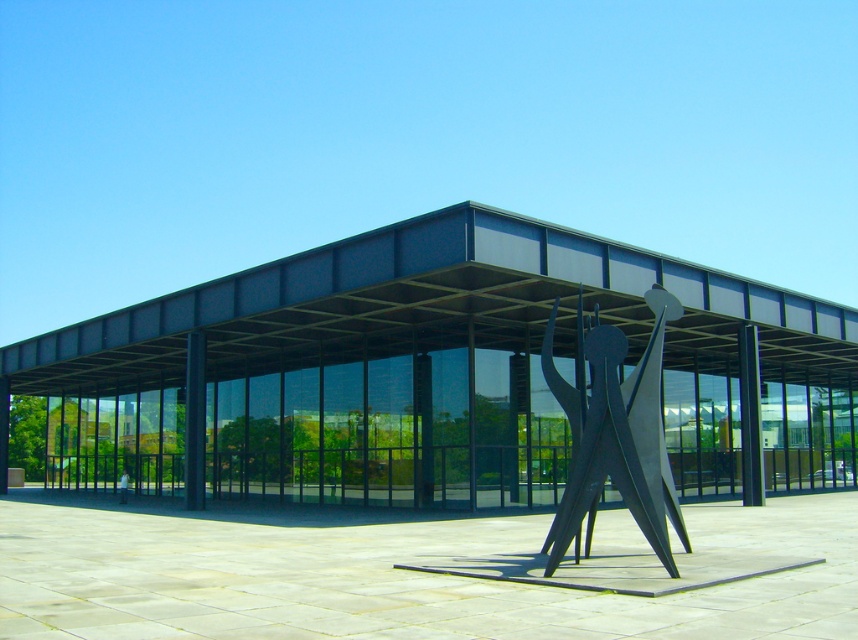
Question: Can you confirm if black metal canopy at center is positioned to the right of polished steel sculpture at center?

Choices:
 (A) yes
 (B) no

Answer: (B)

Question: Does smooth concrete plaza at center appear on the left side of black metal canopy at center?

Choices:
 (A) yes
 (B) no

Answer: (B)

Question: Which of the following is the farthest from the observer?

Choices:
 (A) (521, 612)
 (B) (641, 337)

Answer: (B)

Question: Which of the following is the farthest from the observer?

Choices:
 (A) click(101, 364)
 (B) click(601, 412)
 (C) click(112, 326)

Answer: (A)

Question: Which is farther from the black metal canopy at center?

Choices:
 (A) smooth concrete plaza at center
 (B) polished steel sculpture at center

Answer: (B)

Question: Can you confirm if smooth concrete plaza at center is positioned above polished steel sculpture at center?

Choices:
 (A) no
 (B) yes

Answer: (A)